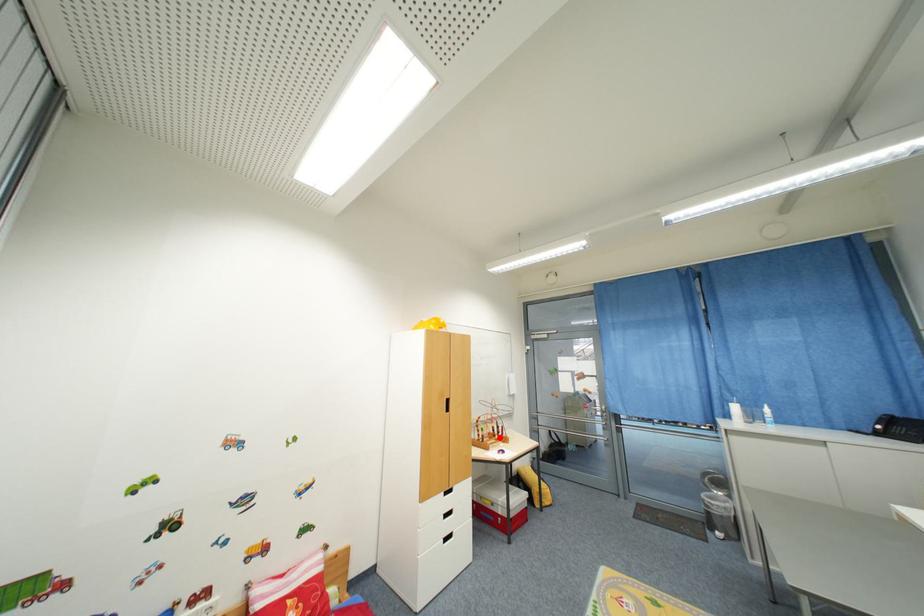
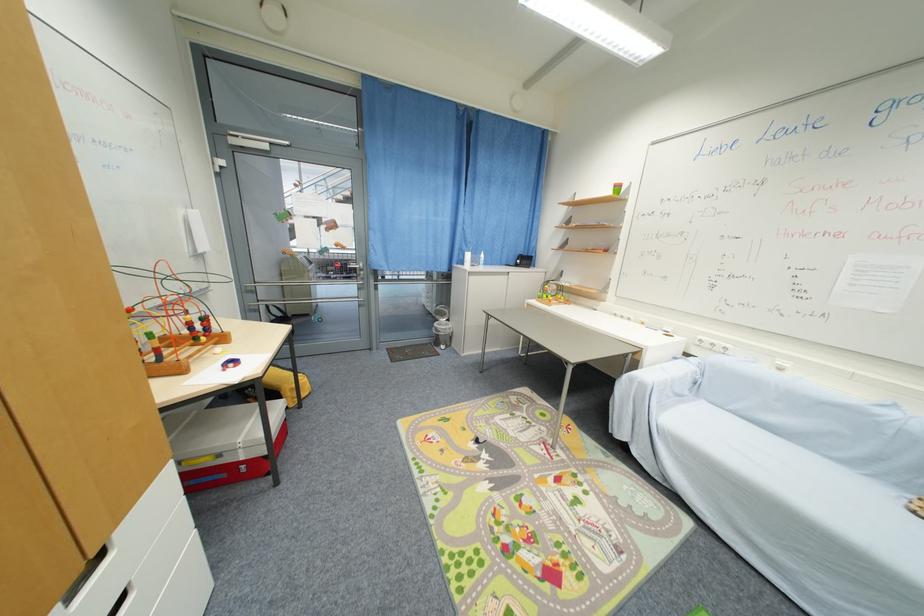
The point at the highlighted location is marked in the first image. Where is the corresponding point in the second image?

(201, 341)